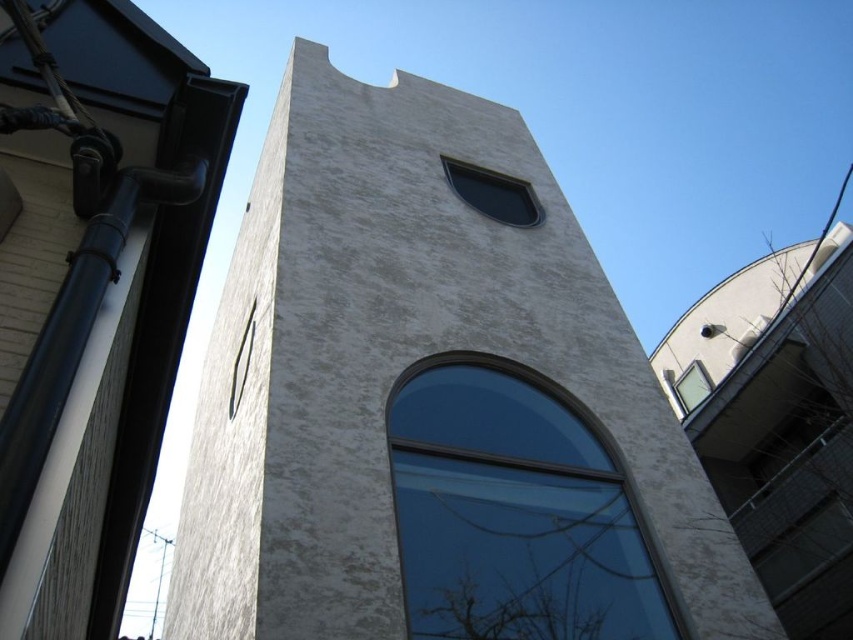
Question: Does transparent glass window at center lie behind metallic silver clock at upper left?

Choices:
 (A) no
 (B) yes

Answer: (A)

Question: Which is nearer to the transparent glass window at upper center?

Choices:
 (A) transparent glass window at center
 (B) metallic silver clock at upper left

Answer: (B)

Question: Does transparent glass window at upper center come in front of clear glass window at upper right?

Choices:
 (A) no
 (B) yes

Answer: (B)

Question: Which of these objects is positioned closest to the white stucco tower at center?

Choices:
 (A) metallic silver clock at upper left
 (B) transparent glass window at upper center

Answer: (A)

Question: Does white stucco tower at center appear on the right side of metallic silver clock at upper left?

Choices:
 (A) yes
 (B) no

Answer: (A)

Question: Which point is farther from the camera taking this photo?

Choices:
 (A) (306, 113)
 (B) (550, 531)
 (C) (697, 365)
 (D) (492, 212)

Answer: (C)